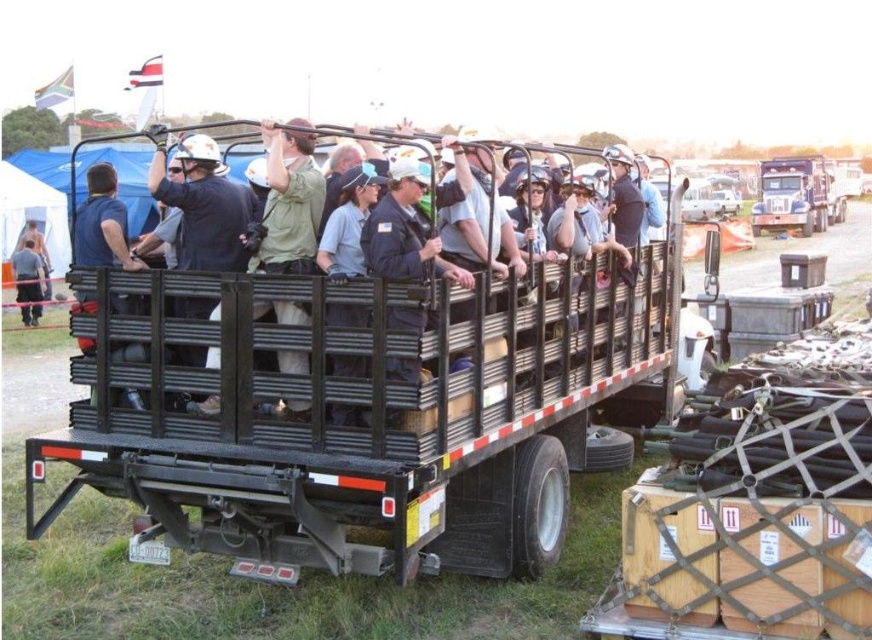
You need to decide whether the metallic silver truck at upper right can be fully covered by a tarp that is the same size as the dark gray uniform at lower left. Based on their sizes, what is your conclusion?

The metallic silver truck at upper right is larger in size than the dark gray uniform at lower left. Therefore, the tarp matching the uniform size would not be sufficient to fully cover the metallic silver truck at upper right.

You are standing in front of the truck and looking at the two points marked on the truck bed. Which point, point (96, 406) or point (19, 300), is closer to you?

Point (96, 406) is closer to you because it is closer to the camera than point (19, 300).